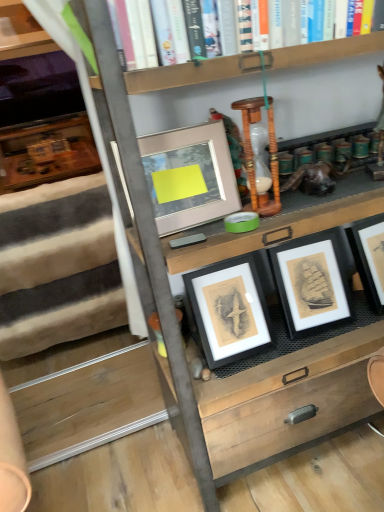
In order to face matte gray picture frame at upper center, the first picture frame in the left-to-right sequence, should I rotate leftwards or rightwards?

Turn left approximately 1.513 degrees to face it.

Locate an element on the screen. hardcover book at upper center is located at coordinates (316, 45).

What do you see at coordinates (316, 45) in the screenshot?
I see `hardcover book at upper center` at bounding box center [316, 45].

The image size is (384, 512). In order to click on matte black picture frame at center, which is the second picture frame from right to left in this screenshot , I will do `click(229, 310)`.

This screenshot has width=384, height=512. Identify the location of wooden table at center. (285, 403).

Is point (197, 187) positioned behind point (5, 46)?

No, (197, 187) is in front of (5, 46).

From a real-world perspective, is matte gray picture frame at upper center, which ranks as the third picture frame in right-to-left order, positioned over matte wood shelf at upper left based on gravity?

Actually, matte gray picture frame at upper center, which ranks as the third picture frame in right-to-left order, is physically below matte wood shelf at upper left in the real world.

Between matte gray picture frame at upper center, which ranks as the third picture frame in right-to-left order, and matte wood shelf at upper left, which one is positioned behind?

matte wood shelf at upper left is more distant.

Does point (263, 203) come farther from viewer compared to point (297, 220)?

Yes, point (263, 203) is behind point (297, 220).

Is wooden hourglass at center located outside wooden table at center?

No, wooden hourglass at center is inside or overlapping with wooden table at center.

Looking at their sizes, would you say wooden hourglass at center is wider or thinner than wooden table at center?

Clearly, wooden hourglass at center has less width compared to wooden table at center.

In terms of height, does wooden hourglass at center look taller or shorter compared to wooden table at center?

Considering their sizes, wooden hourglass at center has less height than wooden table at center.

Is wooden hourglass at center inside the boundaries of matte black picture frame at center, which is the third picture frame in left-to-right order, or outside?

wooden hourglass at center lies outside matte black picture frame at center, which is the third picture frame in left-to-right order.

Does wooden hourglass at center have a lesser width compared to matte black picture frame at center, which is the third picture frame in left-to-right order?

Yes, wooden hourglass at center is thinner than matte black picture frame at center, which is the third picture frame in left-to-right order.

Does wooden hourglass at center have a greater height compared to matte black picture frame at center, which is the third picture frame in left-to-right order?

No, wooden hourglass at center is not taller than matte black picture frame at center, which is the third picture frame in left-to-right order.

Is wooden hourglass at center at the left side of matte black picture frame at center, which is the third picture frame in left-to-right order?

Indeed, wooden hourglass at center is positioned on the left side of matte black picture frame at center, which is the third picture frame in left-to-right order.

Is the position of soft woolen rug at left more distant than that of matte wood shelf at upper left?

No.

Is soft woolen rug at left smaller than matte wood shelf at upper left?

No, soft woolen rug at left is not smaller than matte wood shelf at upper left.

Is soft woolen rug at left to the left or to the right of matte wood shelf at upper left in the image?

soft woolen rug at left is positioned on matte wood shelf at upper left's right side.

From a real-world perspective, does wooden table at center sit lower than soft woolen rug at left?

No.

Can you confirm if wooden table at center is taller than soft woolen rug at left?

Indeed, wooden table at center has a greater height compared to soft woolen rug at left.

Image resolution: width=384 pixels, height=512 pixels. I want to click on stair that is under the wooden table at center (from a real-world perspective), so click(x=58, y=267).

Is soft woolen rug at left completely or partially inside wooden table at center?

Definitely not — soft woolen rug at left is not inside wooden table at center.

Is soft woolen rug at left facing away from matte black picture frame at center, which ranks as the 2th picture frame in left-to-right order?

Yes, matte black picture frame at center, which ranks as the 2th picture frame in left-to-right order, is at the back of soft woolen rug at left.

Does soft woolen rug at left lie in front of matte black picture frame at center, which is the second picture frame from right to left?

No, soft woolen rug at left is behind matte black picture frame at center, which is the second picture frame from right to left.

Can you confirm if soft woolen rug at left is shorter than matte black picture frame at center, which is the second picture frame from right to left?

Incorrect, the height of soft woolen rug at left does not fall short of that of matte black picture frame at center, which is the second picture frame from right to left.

Does point (61, 234) come closer to viewer compared to point (239, 276)?

That is False.

Considering the points (275, 372) and (161, 170), which point is behind, point (275, 372) or point (161, 170)?

Positioned behind is point (275, 372).

The height and width of the screenshot is (512, 384). I want to click on table in front of the matte gray picture frame at upper center, which ranks as the third picture frame in right-to-left order, so click(x=285, y=403).

Is wooden table at center inside or outside of matte gray picture frame at upper center, the first picture frame in the left-to-right sequence?

wooden table at center is not enclosed by matte gray picture frame at upper center, the first picture frame in the left-to-right sequence.

You are a GUI agent. You are given a task and a screenshot of the screen. Output one action in this format:
    pyautogui.click(x=<x>, y=<y>)
    Task: Click on the shelf behind the matte gray picture frame at upper center, which ranks as the third picture frame in right-to-left order
    The image size is (384, 512).
    Given the screenshot: What is the action you would take?
    pyautogui.click(x=21, y=32)

Where is `bar stool above the wooden table at center (from a real-world perspective)`? The height and width of the screenshot is (512, 384). bar stool above the wooden table at center (from a real-world perspective) is located at coordinates (252, 153).

Consider the image. From the image, which object appears to be nearer to hardcover book at upper center, matte black picture frame at center, which is the second picture frame from right to left, or matte black picture frame at center, arranged as the first picture frame when viewed from the right?

matte black picture frame at center, arranged as the first picture frame when viewed from the right, is positioned closer to the anchor hardcover book at upper center.

When comparing their distances from matte wood shelf at upper left, does wooden hourglass at center or matte black picture frame at center, which is the third picture frame in left-to-right order, seem closer?

The object closer to matte wood shelf at upper left is wooden hourglass at center.

Based on their spatial positions, is hardcover book at upper center or wooden hourglass at center closer to matte gray picture frame at upper center, which ranks as the third picture frame in right-to-left order?

wooden hourglass at center is positioned closer to the anchor matte gray picture frame at upper center, which ranks as the third picture frame in right-to-left order.

Which object lies nearer to the anchor point wooden hourglass at center, matte wood shelf at upper left or matte gray picture frame at upper center, which ranks as the third picture frame in right-to-left order?

matte gray picture frame at upper center, which ranks as the third picture frame in right-to-left order, is closer to wooden hourglass at center.

When comparing their distances from matte black picture frame at center, arranged as the first picture frame when viewed from the right, does wooden hourglass at center or hardcover book at upper center seem closer?

wooden hourglass at center.

When comparing their distances from matte black picture frame at center, which is the third picture frame in left-to-right order, does soft woolen rug at left or wooden table at center seem closer?

wooden table at center.

Which object lies further to the anchor point matte gray picture frame at upper center, the first picture frame in the left-to-right sequence, soft woolen rug at left or wooden hourglass at center?

soft woolen rug at left.

When comparing their distances from wooden table at center, does soft woolen rug at left or hardcover book at upper center seem closer?

hardcover book at upper center lies closer to wooden table at center than the other object.

The height and width of the screenshot is (512, 384). In order to click on bar stool between matte gray picture frame at upper center, which ranks as the third picture frame in right-to-left order, and matte wood shelf at upper left in the front-back direction in this screenshot , I will do `click(252, 153)`.

Image resolution: width=384 pixels, height=512 pixels. I want to click on picture frame positioned between matte black picture frame at center, which ranks as the 2th picture frame in left-to-right order, and matte wood shelf at upper left from near to far, so click(x=311, y=283).

Identify the location of stair between matte black picture frame at center, arranged as the first picture frame when viewed from the right, and matte wood shelf at upper left, along the z-axis. (58, 267).

This screenshot has height=512, width=384. In order to click on book located between soft woolen rug at left and matte black picture frame at center, arranged as the first picture frame when viewed from the right, in the left-right direction in this screenshot , I will do `click(316, 45)`.